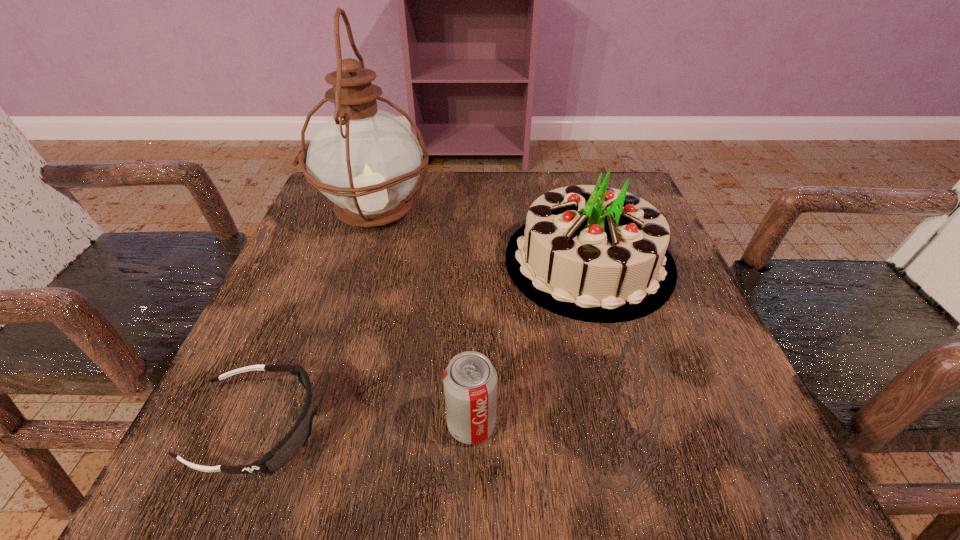
What are the coordinates of `vacant region between the third object from left to right and the goggles` in the screenshot? It's located at (366, 426).

I want to click on free space between the third tallest object and the goggles, so click(366, 426).

At what (x,y) coordinates should I click in order to perform the action: click on vacant space that is in between the oil lamp and the rightmost object. Please return your answer as a coordinate pair (x, y). This screenshot has height=540, width=960. Looking at the image, I should click on (481, 237).

The width and height of the screenshot is (960, 540). I want to click on free space between the tallest object and the third tallest object, so click(422, 318).

You are a GUI agent. You are given a task and a screenshot of the screen. Output one action in this format:
    pyautogui.click(x=<x>, y=<y>)
    Task: Click on the vacant area between the oil lamp and the third object from left to right
    Image resolution: width=960 pixels, height=540 pixels.
    Given the screenshot: What is the action you would take?
    pyautogui.click(x=422, y=318)

Find the location of a particular element. object that stands as the second closest to the shortest object is located at coordinates (592, 253).

Identify the location of the closest object to the rightmost object. Image resolution: width=960 pixels, height=540 pixels. (470, 380).

Where is `free location that satisfies the following two spatial constraints: 1. on the front side of the oil lamp; 2. on the front and sides of the shortest object`? The width and height of the screenshot is (960, 540). free location that satisfies the following two spatial constraints: 1. on the front side of the oil lamp; 2. on the front and sides of the shortest object is located at coordinates [x=303, y=427].

You are a GUI agent. You are given a task and a screenshot of the screen. Output one action in this format:
    pyautogui.click(x=<x>, y=<y>)
    Task: Click on the vacant space that satisfies the following two spatial constraints: 1. on the front side of the third shortest object; 2. on the front and sides of the goggles
    The width and height of the screenshot is (960, 540).
    Given the screenshot: What is the action you would take?
    pyautogui.click(x=636, y=427)

Find the location of `vacant region that satisfies the following two spatial constraints: 1. on the front side of the third tallest object; 2. on the front and sides of the goggles`. vacant region that satisfies the following two spatial constraints: 1. on the front side of the third tallest object; 2. on the front and sides of the goggles is located at coordinates (471, 427).